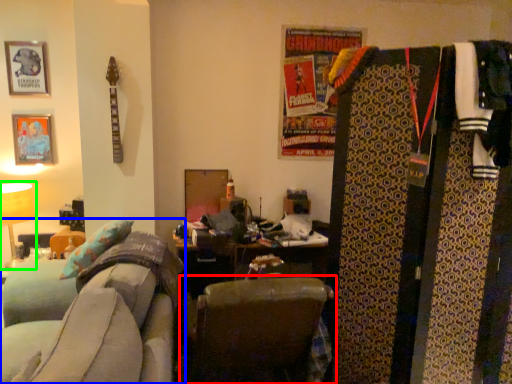
Question: Considering the real-world distances, which object is farthest from chair (highlighted by a red box)? furniture (highlighted by a blue box) or table lamp (highlighted by a green box)?

Choices:
 (A) furniture
 (B) table lamp

Answer: (B)